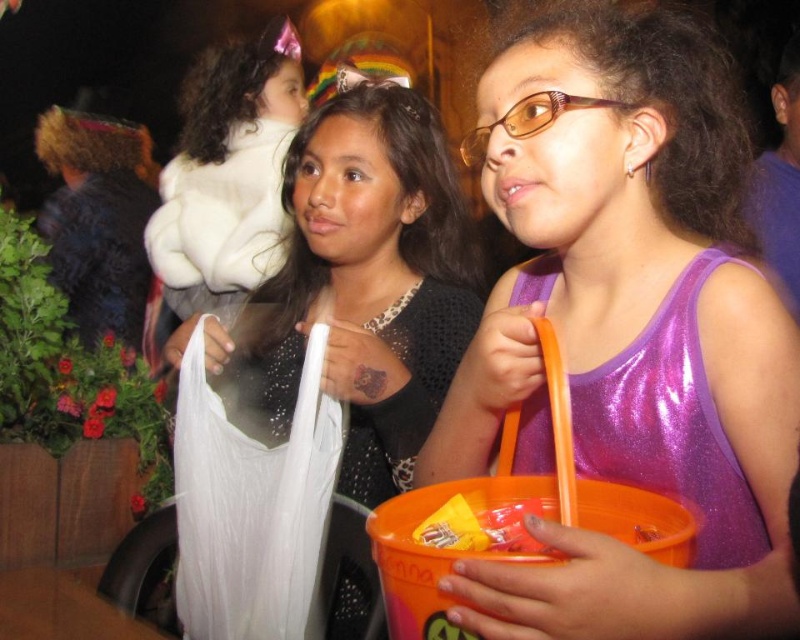
Does white matte plastic bag at center have a smaller size compared to white fluffy coat at upper left?

Indeed, white matte plastic bag at center has a smaller size compared to white fluffy coat at upper left.

Who is positioned more to the left, white matte plastic bag at center or white fluffy coat at upper left?

white fluffy coat at upper left is more to the left.

I want to click on white matte plastic bag at center, so click(362, 285).

Between purple shiny tank top at center and white fluffy coat at upper left, which one has less height?

Standing shorter between the two is purple shiny tank top at center.

Can you confirm if purple shiny tank top at center is positioned above white fluffy coat at upper left?

No.

Identify the location of purple shiny tank top at center. The width and height of the screenshot is (800, 640). (628, 330).

Can you confirm if white matte plastic bag at center is thinner than shiny purple dress at center?

No.

Is white matte plastic bag at center bigger than shiny purple dress at center?

Indeed, white matte plastic bag at center has a larger size compared to shiny purple dress at center.

Is point (444, 218) less distant than point (525, 448)?

No, (444, 218) is further to viewer.

Find the location of `white matte plastic bag at center`. white matte plastic bag at center is located at coordinates pyautogui.click(x=362, y=285).